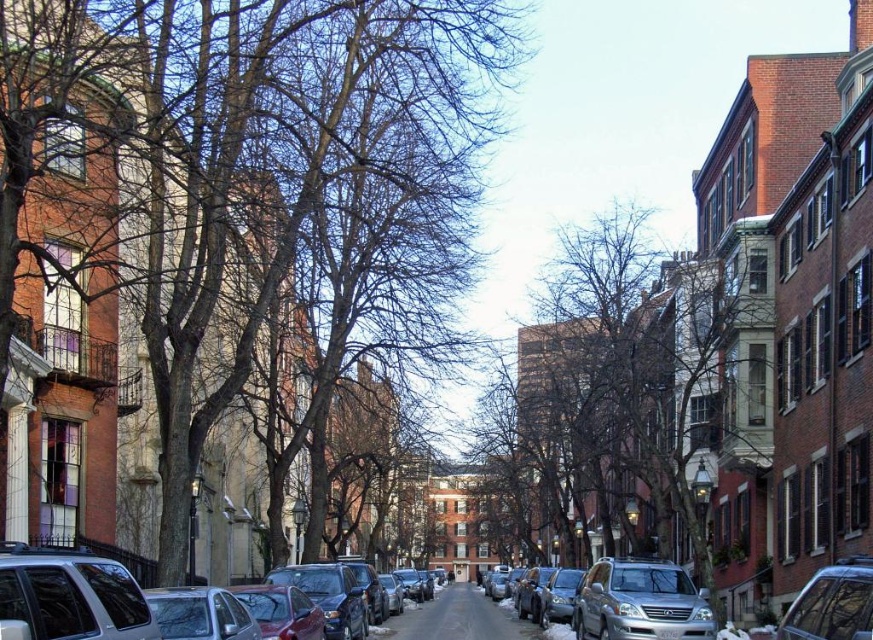
You are a delivery driver who needs to park your vehicle in this street. You have a matte silver suv at lower left and a silver metallic suv at center in your view. Which of these two SUVs is shorter in height?

The matte silver suv at lower left is shorter than the silver metallic suv at center.

You are a delivery drone flying above the street. You need to deliver a package to a location behind the metallic silver car at lower right. The smooth brown tree at center is in your path. Can you safely fly over the tree without hitting it?

The smooth brown tree at center is taller than the metallic silver car at lower right. Since the tree is taller, the drone cannot safely fly over it without risking collision, so it should find an alternative route around the tree.